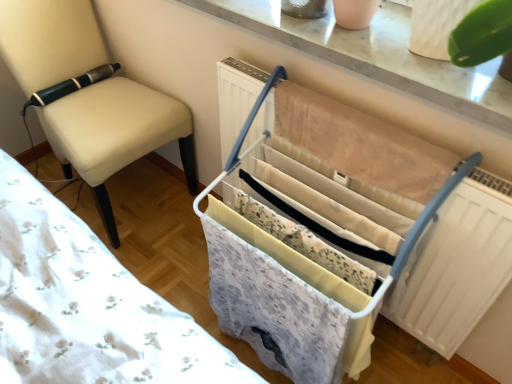
Question: Is white plastic drying rack at center not close to beige fabric chair at left?

Choices:
 (A) no
 (B) yes

Answer: (A)

Question: Is white plastic drying rack at center at the left side of beige fabric chair at left?

Choices:
 (A) yes
 (B) no

Answer: (B)

Question: Does white plastic drying rack at center lie behind beige fabric chair at left?

Choices:
 (A) no
 (B) yes

Answer: (A)

Question: Can you confirm if white plastic drying rack at center is thinner than beige fabric chair at left?

Choices:
 (A) yes
 (B) no

Answer: (A)

Question: Is white plastic drying rack at center with beige fabric chair at left?

Choices:
 (A) yes
 (B) no

Answer: (B)

Question: Is white plastic drying rack at center smaller than beige fabric chair at left?

Choices:
 (A) yes
 (B) no

Answer: (A)

Question: Is beige fabric chair at left positioned with its back to white plastic drying rack at center?

Choices:
 (A) yes
 (B) no

Answer: (B)

Question: Is the depth of beige fabric chair at left greater than that of white plastic drying rack at center?

Choices:
 (A) no
 (B) yes

Answer: (B)

Question: Are beige fabric chair at left and white plastic drying rack at center beside each other?

Choices:
 (A) no
 (B) yes

Answer: (A)

Question: Can you confirm if beige fabric chair at left is positioned to the right of white plastic drying rack at center?

Choices:
 (A) no
 (B) yes

Answer: (A)

Question: Could you tell me if beige fabric chair at left is facing white plastic drying rack at center?

Choices:
 (A) no
 (B) yes

Answer: (B)

Question: Is beige fabric chair at left smaller than white plastic drying rack at center?

Choices:
 (A) no
 (B) yes

Answer: (A)

Question: In terms of size, does beige fabric chair at left appear bigger or smaller than white plastic drying rack at center?

Choices:
 (A) big
 (B) small

Answer: (A)